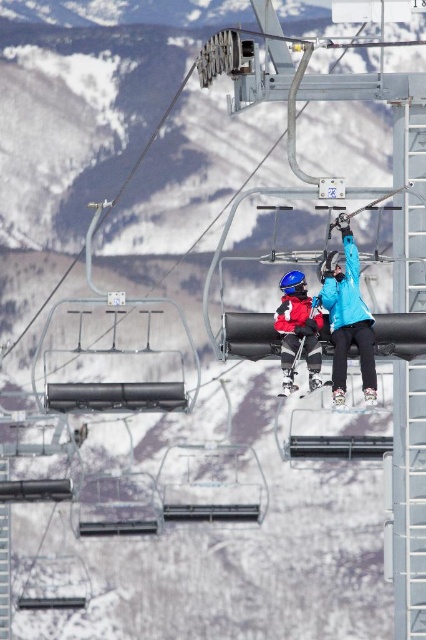
Does blue matte jacket at upper center have a lesser height compared to matte red ski suit at center?

Correct, blue matte jacket at upper center is not as tall as matte red ski suit at center.

Between blue matte jacket at upper center and matte red ski suit at center, which one appears on the right side from the viewer's perspective?

Positioned to the right is blue matte jacket at upper center.

Which is in front, point (354, 284) or point (314, 371)?

Point (314, 371) is more forward.

Where is `blue matte jacket at upper center`? The image size is (426, 640). blue matte jacket at upper center is located at coordinates (348, 317).